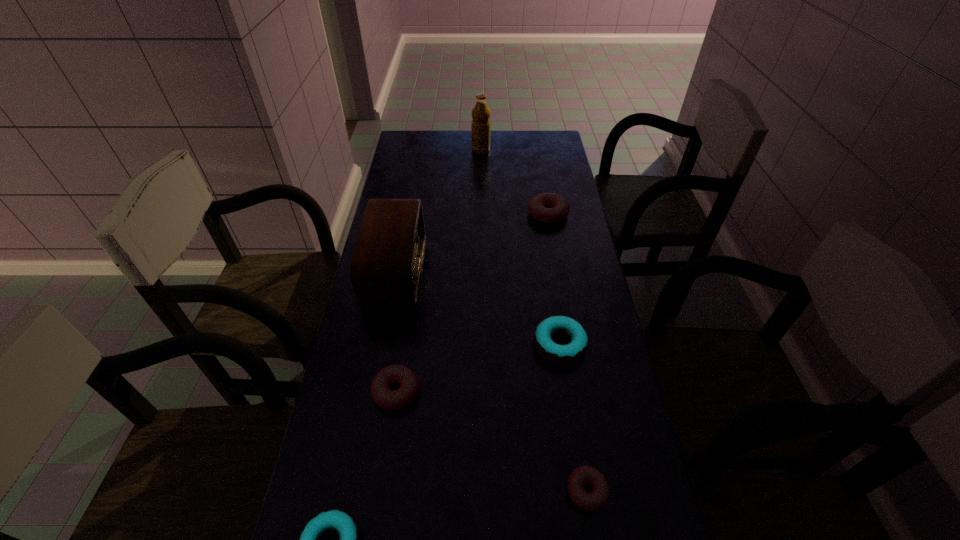
Point out which object is positioned as the fourth nearest to the sixth shortest object. Please provide its 2D coordinates. Your answer should be formatted as a tuple, i.e. [(x, y)], where the tuple contains the x and y coordinates of a point satisfying the conditions above.

[(343, 523)]

Find the location of a particular element. Image resolution: width=960 pixels, height=540 pixels. doughnut that is the nearest to the radio receiver is located at coordinates (385, 398).

Where is `doughnut that is the fourth closest one to the radio receiver`? This screenshot has height=540, width=960. doughnut that is the fourth closest one to the radio receiver is located at coordinates (343, 523).

At what (x,y) coordinates should I click in order to perform the action: click on pink doughnut that is the second closest to the third nearest doughnut. Please return your answer as a coordinate pair (x, y). Looking at the image, I should click on (550, 208).

Choose which pink doughnut is the third nearest neighbor to the fourth nearest doughnut. Please provide its 2D coordinates. Your answer should be formatted as a tuple, i.e. [(x, y)], where the tuple contains the x and y coordinates of a point satisfying the conditions above.

[(550, 208)]

Select which blue doughnut appears as the second closest to the fifth nearest object. Please provide its 2D coordinates. Your answer should be formatted as a tuple, i.e. [(x, y)], where the tuple contains the x and y coordinates of a point satisfying the conditions above.

[(343, 523)]

Locate an element on the screen. blue doughnut that is the second closest to the farthest doughnut is located at coordinates (343, 523).

Locate an element on the screen. vacant space that satisfies the following two spatial constraints: 1. on the front label of the sixth nearest object; 2. on the left side of the fruit juice is located at coordinates (481, 214).

Identify the location of vacant region that satisfies the following two spatial constraints: 1. on the front panel of the fourth nearest object; 2. on the left side of the third farthest object. Image resolution: width=960 pixels, height=540 pixels. (382, 345).

Find the location of a particular element. Image resolution: width=960 pixels, height=540 pixels. free point that satisfies the following two spatial constraints: 1. on the front panel of the sixth shortest object; 2. on the right side of the fourth farthest object is located at coordinates pos(382,345).